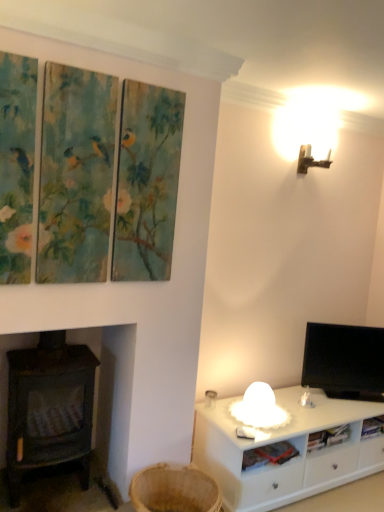
Question: Considering the relative positions of white plastic shelf at lower right and black glossy tv at right in the image provided, is white plastic shelf at lower right to the left of black glossy tv at right from the viewer's perspective?

Choices:
 (A) no
 (B) yes

Answer: (B)

Question: Could you tell me if white plastic shelf at lower right is turned towards black glossy tv at right?

Choices:
 (A) no
 (B) yes

Answer: (A)

Question: Considering the relative positions of white plastic shelf at lower right and black glossy tv at right in the image provided, is white plastic shelf at lower right to the right of black glossy tv at right from the viewer's perspective?

Choices:
 (A) no
 (B) yes

Answer: (A)

Question: Does white plastic shelf at lower right have a greater width compared to black glossy tv at right?

Choices:
 (A) yes
 (B) no

Answer: (A)

Question: Does white plastic shelf at lower right have a lesser height compared to black glossy tv at right?

Choices:
 (A) yes
 (B) no

Answer: (A)

Question: Does white plastic shelf at lower right come in front of black glossy tv at right?

Choices:
 (A) yes
 (B) no

Answer: (A)

Question: Considering the relative positions of white fabric table lamp at lower right and dark brown wood burning stove at left in the image provided, is white fabric table lamp at lower right to the left of dark brown wood burning stove at left from the viewer's perspective?

Choices:
 (A) yes
 (B) no

Answer: (B)

Question: Is white fabric table lamp at lower right smaller than dark brown wood burning stove at left?

Choices:
 (A) no
 (B) yes

Answer: (B)

Question: Is white fabric table lamp at lower right far from dark brown wood burning stove at left?

Choices:
 (A) yes
 (B) no

Answer: (B)

Question: Is white fabric table lamp at lower right oriented away from dark brown wood burning stove at left?

Choices:
 (A) yes
 (B) no

Answer: (B)

Question: Is white fabric table lamp at lower right bigger than dark brown wood burning stove at left?

Choices:
 (A) yes
 (B) no

Answer: (B)

Question: Is the depth of white fabric table lamp at lower right greater than that of dark brown wood burning stove at left?

Choices:
 (A) no
 (B) yes

Answer: (B)

Question: Is black glossy tv at right to the left of dark brown wood burning stove at left from the viewer's perspective?

Choices:
 (A) no
 (B) yes

Answer: (A)